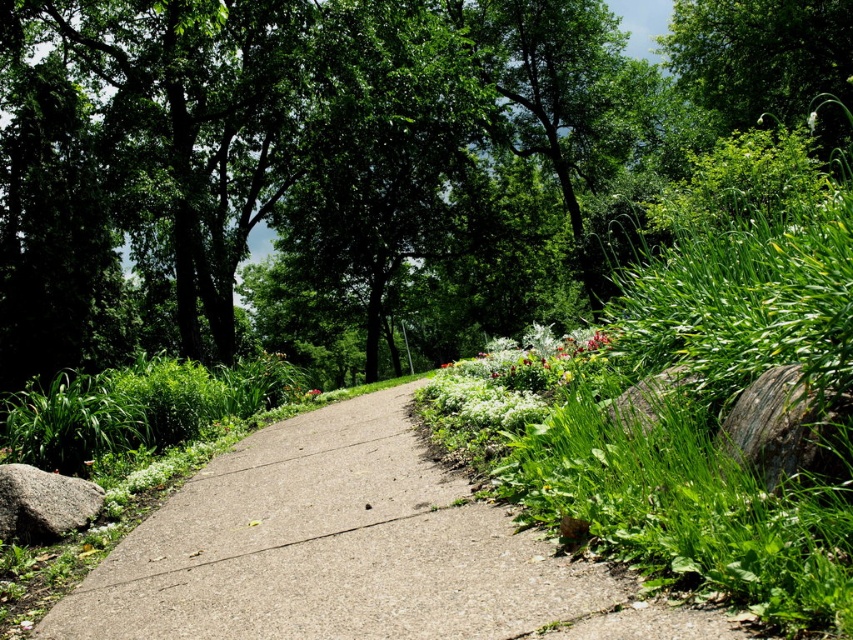
You are a gardener who needs to mow the lawn. You see the gray concrete pavement at center and the green matte flower at center. Which one is shorter and thus requires less trimming?

The gray concrete pavement at center is shorter than the green matte flower at center, so it requires less trimming.

You are a gardener who wants to plant a new flower bed between the white matte flowers at center and the gray rough rock at lower right. Based on their positions, which object should you start digging near to create the flower bed in the middle?

The white matte flowers at center is above the gray rough rock at lower right, so you should start digging near the gray rough rock at lower right since it is lower in position and the middle would be between them.

You are standing on the gray concrete pavement at center and want to pick the green matte flower at center. Can you reach it without stepping off the pavement?

The gray concrete pavement at center is closer to the viewer than the green matte flower at center, so you cannot reach the green matte flower at center without stepping off the pavement because it is further away.